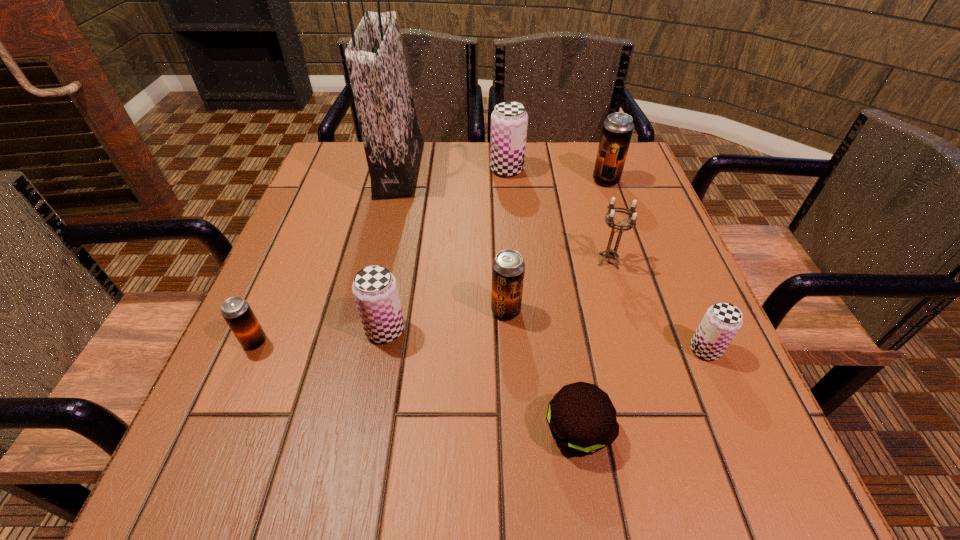
At what (x,y) coordinates should I click in order to perform the action: click on vacant space that's between the biggest black beer can and the smallest purple beer can. Please return your answer as a coordinate pair (x, y). This screenshot has height=540, width=960. Looking at the image, I should click on (656, 265).

What are the coordinates of `empty space between the biggest purple beer can and the fifth beer can from left to right` in the screenshot? It's located at (557, 175).

At what (x,y) coordinates should I click in order to perform the action: click on unoccupied position between the shortest object and the second purple beer can from left to right. Please return your answer as a coordinate pair (x, y). This screenshot has width=960, height=540. Looking at the image, I should click on (542, 300).

Locate an element on the screen. This screenshot has width=960, height=540. vacant area that lies between the second smallest black beer can and the tallest object is located at coordinates (452, 240).

Image resolution: width=960 pixels, height=540 pixels. I want to click on unoccupied position between the smallest purple beer can and the tallest object, so click(x=552, y=260).

The height and width of the screenshot is (540, 960). What are the coordinates of `free space between the farthest purple beer can and the leftmost beer can` in the screenshot? It's located at (381, 256).

At what (x,y) coordinates should I click in order to perform the action: click on vacant area that lies between the nearest black beer can and the biggest purple beer can. Please return your answer as a coordinate pair (x, y). The image size is (960, 540). Looking at the image, I should click on (381, 256).

This screenshot has height=540, width=960. Find the location of `object that is the fifth closest to the shortest object`. object that is the fifth closest to the shortest object is located at coordinates (239, 316).

Where is `object that is the second closest to the patty`? The image size is (960, 540). object that is the second closest to the patty is located at coordinates (722, 321).

Image resolution: width=960 pixels, height=540 pixels. I want to click on beer can that stands as the fourth closest to the second farthest black beer can, so click(x=509, y=120).